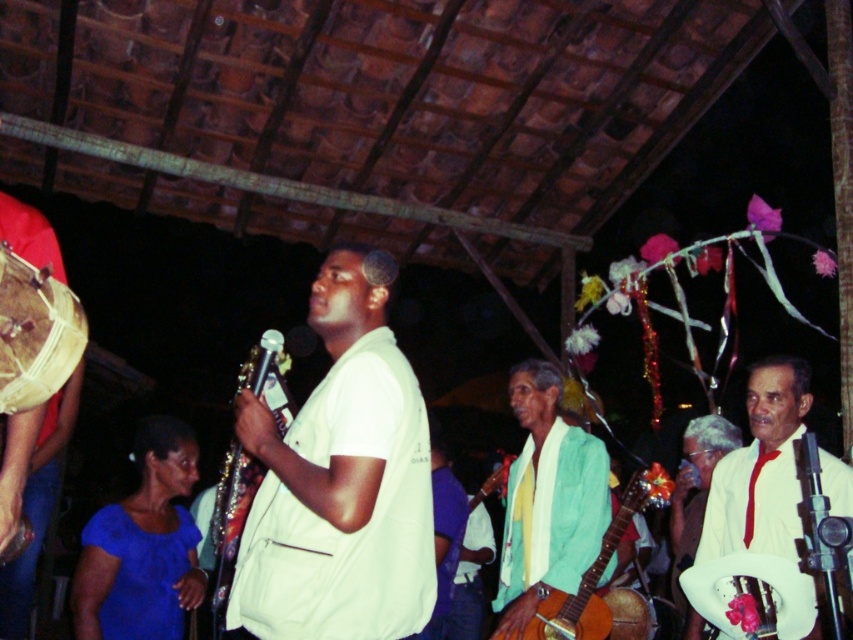
Question: Which point is farther to the camera?

Choices:
 (A) wooden drum at left
 (B) white satin hat at right
 (C) white fabric drum at lower right
 (D) white matte shirt at center

Answer: (B)

Question: Is white satin hat at right to the left of black metallic microphone at center from the viewer's perspective?

Choices:
 (A) yes
 (B) no

Answer: (B)

Question: Which point is closer to the camera?

Choices:
 (A) white satin hat at lower right
 (B) light green fabric guitar at center
 (C) white fabric drum at lower right
 (D) natural wood drum at left

Answer: (D)

Question: Can you confirm if wooden drum at left is positioned above white fabric drum at lower right?

Choices:
 (A) yes
 (B) no

Answer: (A)

Question: Which object is closer to the camera taking this photo?

Choices:
 (A) wooden drum at left
 (B) white satin hat at right
 (C) natural wood drum at left

Answer: (C)

Question: Where is white satin hat at right located in relation to brown wooden drum at center in the image?

Choices:
 (A) left
 (B) right

Answer: (B)